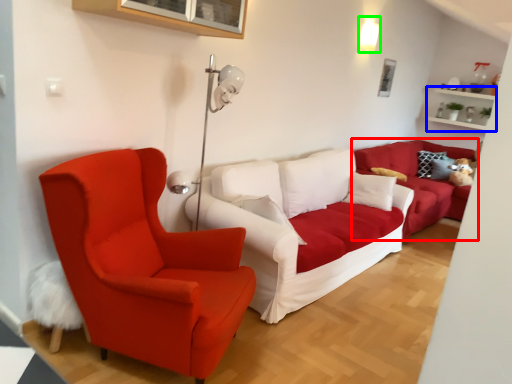
Question: Estimate the real-world distances between objects in this image. Which object is closer to studio couch (highlighted by a red box), shelf (highlighted by a blue box) or light fixture (highlighted by a green box)?

Choices:
 (A) shelf
 (B) light fixture

Answer: (B)